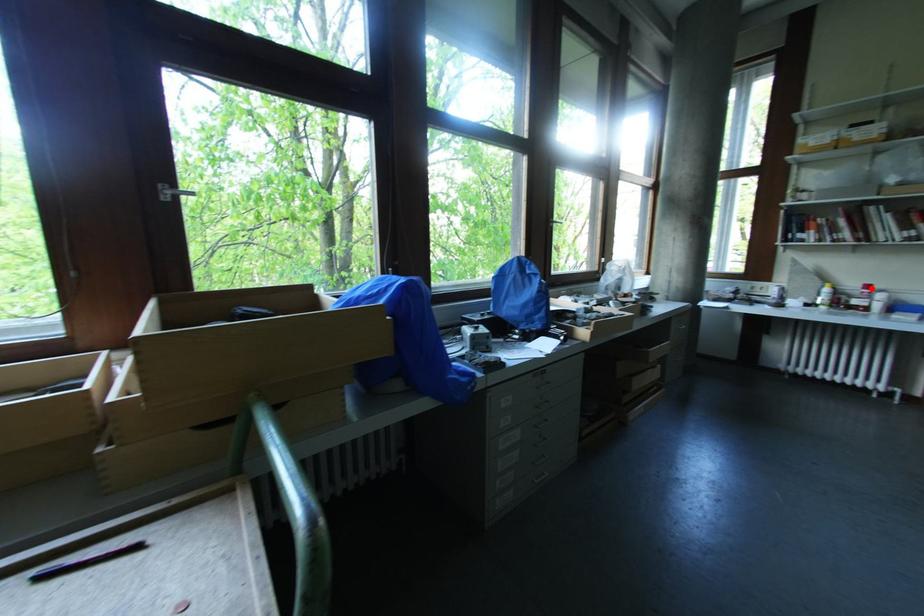
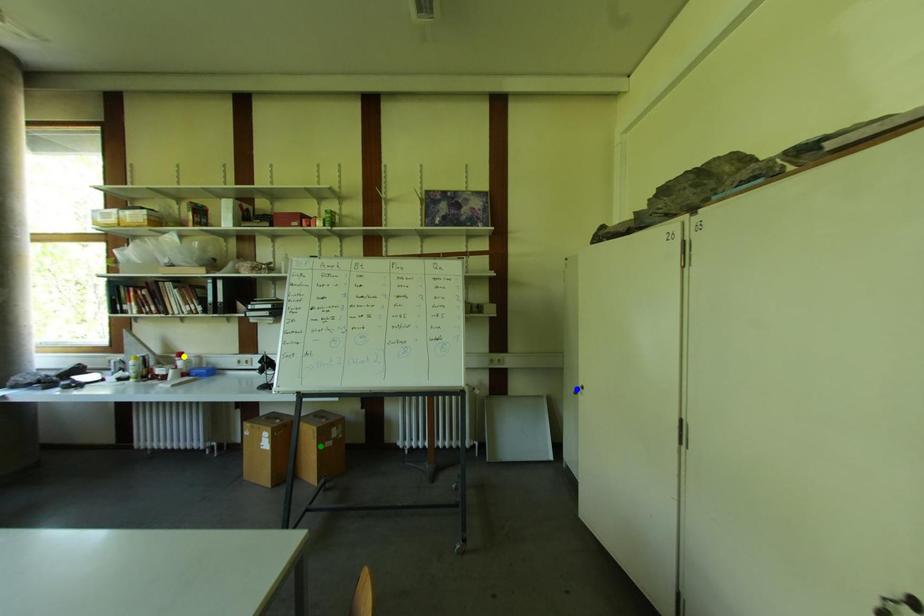
Question: I am providing you with two images of the same scene from different viewpoints. A red point is marked on the first image. You are given multiple points on the second image. Which point in image 2 is actually the same real-world point as the red point in image 1?

Choices:
 (A) green point
 (B) yellow point
 (C) blue point

Answer: (B)